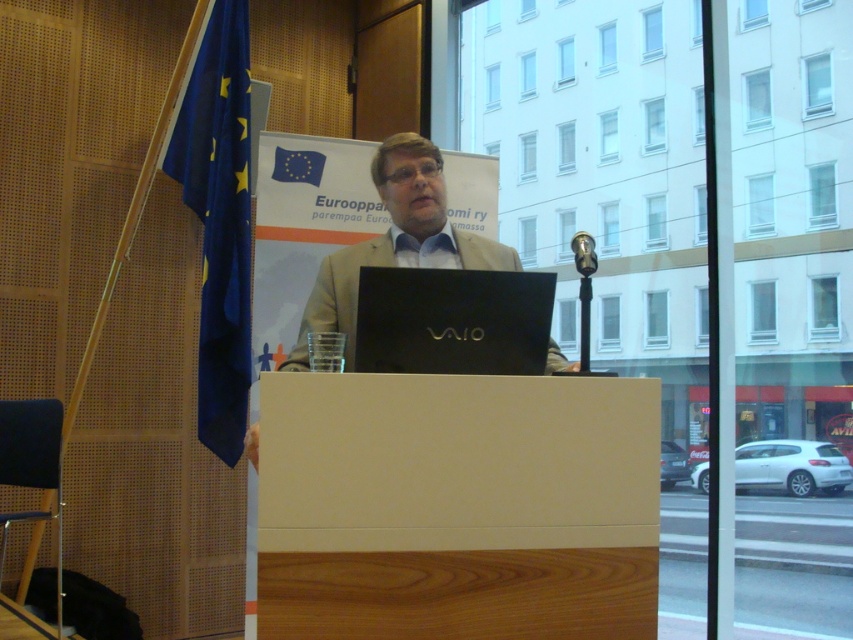
You are organizing a conference and need to set up a speaker station. The speaker requires that the black matte laptop at center must be placed above the metallic at right. Based on the current setup shown in the image, is this requirement met?

The black matte laptop at center is located below the metallic at right, so the requirement is not met.

Based on the scene, which object is narrower between the blue fabric flag at left and the matte black laptop at center?

The blue fabric flag at left is thinner than the matte black laptop at center, so the blue fabric flag at left is narrower.

You are organizing a tech conference and need to place both the matte black laptop at center and the metallic at right on a narrow shelf. Based on their sizes, which one should you place first to maximize shelf space?

The matte black laptop at center might be wider than metallic at right, so you should place the wider matte black laptop at center first to optimize shelf space.